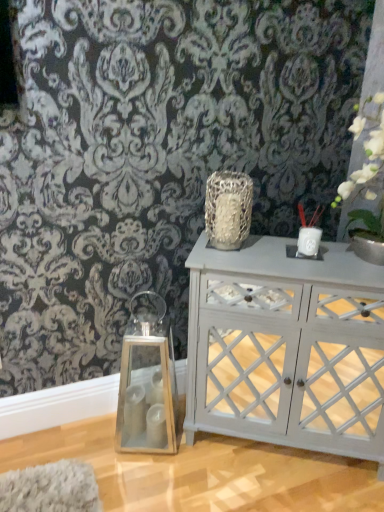
In order to click on vacant space situated on the left part of clear glass lantern at left, which is counted as the first candle holder, starting from the bottom in this screenshot , I will do `click(85, 437)`.